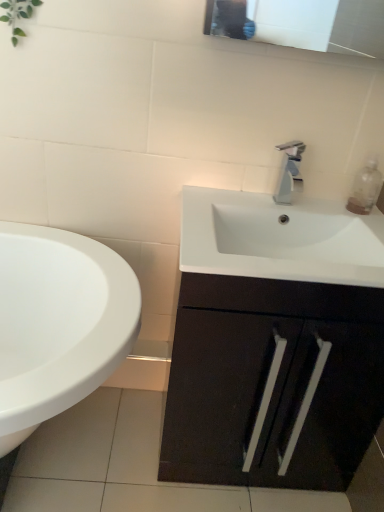
What do you see at coordinates (289, 170) in the screenshot? This screenshot has width=384, height=512. I see `silver metallic faucet at center` at bounding box center [289, 170].

This screenshot has width=384, height=512. Identify the location of matte black cabinet at center. (x=272, y=382).

Measure the distance between point [43,334] and camera.

1.38 meters.

The image size is (384, 512). In order to click on white glossy sink at lower left in this screenshot , I will do `click(58, 323)`.

Locate an element on the screen. silver metallic faucet at center is located at coordinates (289, 170).

Is there a large distance between matte black cabinet at center and clear plastic bottle at upper right?

matte black cabinet at center is actually quite close to clear plastic bottle at upper right.

Find the location of a particular element. Image resolution: width=384 pixels, height=512 pixels. soap dispenser behind the matte black cabinet at center is located at coordinates click(365, 189).

Is matte black cabinet at center inside the boundaries of clear plastic bottle at upper right, or outside?

matte black cabinet at center is outside clear plastic bottle at upper right.

Is matte black cabinet at center facing away from clear plastic bottle at upper right?

No, matte black cabinet at center is not facing the opposite direction of clear plastic bottle at upper right.

Is matte black cabinet at center surrounded by white glossy sink at lower left?

No, matte black cabinet at center is not surrounded by white glossy sink at lower left.

Considering the relative sizes of white glossy sink at lower left and matte black cabinet at center in the image provided, is white glossy sink at lower left smaller than matte black cabinet at center?

Actually, white glossy sink at lower left might be larger than matte black cabinet at center.

Between white glossy sink at lower left and matte black cabinet at center, which one appears on the right side from the viewer's perspective?

matte black cabinet at center is more to the right.

Is white glossy sink at lower left directly adjacent to matte black cabinet at center?

There is a gap between white glossy sink at lower left and matte black cabinet at center.

Is silver metallic faucet at center directly adjacent to matte black cabinet at center?

No, silver metallic faucet at center is not making contact with matte black cabinet at center.

Considering the relative sizes of silver metallic faucet at center and matte black cabinet at center in the image provided, is silver metallic faucet at center thinner than matte black cabinet at center?

Yes.

Does silver metallic faucet at center appear on the left side of matte black cabinet at center?

No.

Which object is closer to the camera, clear plastic bottle at upper right or white glossy sink at lower left?

white glossy sink at lower left is closer to the camera.

Can you confirm if clear plastic bottle at upper right is smaller than white glossy sink at lower left?

Correct, clear plastic bottle at upper right occupies less space than white glossy sink at lower left.

Is clear plastic bottle at upper right far from white glossy sink at lower left?

They are positioned close to each other.

From a real-world perspective, which object stands above the other?

In real-world perspective, clear plastic bottle at upper right is above.

From a real-world perspective, who is located higher, silver metallic faucet at center or white glossy sink at lower left?

In real-world perspective, silver metallic faucet at center is above.

Can you see silver metallic faucet at center touching white glossy sink at lower left?

silver metallic faucet at center and white glossy sink at lower left are not in contact.

Is silver metallic faucet at center to the right of white glossy sink at lower left from the viewer's perspective?

Yes.

Considering the sizes of objects white glossy sink at lower left and clear plastic bottle at upper right in the image provided, who is wider, white glossy sink at lower left or clear plastic bottle at upper right?

white glossy sink at lower left is wider.

Could you tell me if white glossy sink at lower left is facing clear plastic bottle at upper right?

No, white glossy sink at lower left is not turned towards clear plastic bottle at upper right.

Can you tell me how much white glossy sink at lower left and clear plastic bottle at upper right differ in facing direction?

They differ by 0.47 degrees in their facing directions.

Is white glossy sink at lower left further to camera compared to clear plastic bottle at upper right?

No, the depth of white glossy sink at lower left is less than that of clear plastic bottle at upper right.

Is matte black cabinet at center inside the boundaries of white glossy sink at lower left, or outside?

matte black cabinet at center cannot be found inside white glossy sink at lower left.

Which object is positioned more to the right, matte black cabinet at center or white glossy sink at lower left?

matte black cabinet at center is more to the right.

Where is `bathroom cabinet above the white glossy sink at lower left (from the image's perspective)`? The image size is (384, 512). bathroom cabinet above the white glossy sink at lower left (from the image's perspective) is located at coordinates (272, 382).

Can you confirm if matte black cabinet at center is bigger than white glossy sink at lower left?

Incorrect, matte black cabinet at center is not larger than white glossy sink at lower left.

Find the location of a particular element. The width and height of the screenshot is (384, 512). soap dispenser on the right side of matte black cabinet at center is located at coordinates (365, 189).

You are a GUI agent. You are given a task and a screenshot of the screen. Output one action in this format:
    pyautogui.click(x=<x>, y=<y>)
    Task: Click on the sink on the left of matte black cabinet at center
    
    Given the screenshot: What is the action you would take?
    pyautogui.click(x=58, y=323)

Based on their spatial positions, is clear plastic bottle at upper right or white glossy sink at lower left closer to silver metallic faucet at center?

Among the two, clear plastic bottle at upper right is located nearer to silver metallic faucet at center.

When comparing their distances from matte black cabinet at center, does silver metallic faucet at center or clear plastic bottle at upper right seem closer?

Among the two, silver metallic faucet at center is located nearer to matte black cabinet at center.

Looking at the image, which one is located closer to clear plastic bottle at upper right, matte black cabinet at center or silver metallic faucet at center?

The object closer to clear plastic bottle at upper right is silver metallic faucet at center.

Which object lies further to the anchor point white glossy sink at lower left, matte black cabinet at center or clear plastic bottle at upper right?

clear plastic bottle at upper right.

From the image, which object appears to be farther from clear plastic bottle at upper right, silver metallic faucet at center or white glossy sink at lower left?

The object further to clear plastic bottle at upper right is white glossy sink at lower left.

Estimate the real-world distances between objects in this image. Which object is further from white glossy sink at lower left, silver metallic faucet at center or clear plastic bottle at upper right?

The object further to white glossy sink at lower left is clear plastic bottle at upper right.

Which object lies nearer to the anchor point silver metallic faucet at center, white glossy sink at lower left or matte black cabinet at center?

matte black cabinet at center lies closer to silver metallic faucet at center than the other object.

Looking at the image, which one is located further to white glossy sink at lower left, clear plastic bottle at upper right or silver metallic faucet at center?

clear plastic bottle at upper right.

The image size is (384, 512). I want to click on bathroom cabinet located between white glossy sink at lower left and silver metallic faucet at center in the left-right direction, so click(x=272, y=382).

The height and width of the screenshot is (512, 384). I want to click on tap between white glossy sink at lower left and clear plastic bottle at upper right, so click(x=289, y=170).

The height and width of the screenshot is (512, 384). I want to click on bathroom cabinet between white glossy sink at lower left and clear plastic bottle at upper right from left to right, so click(272, 382).

Find the location of a particular element. This screenshot has height=512, width=384. soap dispenser between silver metallic faucet at center and matte black cabinet at center in the vertical direction is located at coordinates (365, 189).